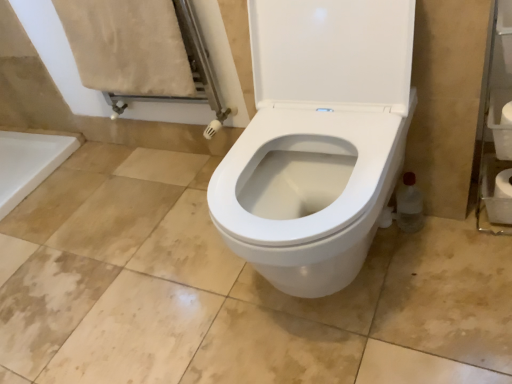
What do you see at coordinates (502, 130) in the screenshot?
I see `white matte toilet paper at right, acting as the 2th toilet paper starting from the back` at bounding box center [502, 130].

This screenshot has height=384, width=512. Identify the location of white matte toilet paper at right, acting as the second toilet paper starting from the bottom. (502, 130).

What is the approximate height of white matte toilet paper at right, which is the 1th toilet paper in back-to-front order?

5.09 inches.

This screenshot has width=512, height=384. I want to click on white matte toilet paper at right, the 2th toilet paper positioned from the top, so [498, 196].

What do you see at coordinates (498, 196) in the screenshot? This screenshot has width=512, height=384. I see `white matte toilet paper at right, which is the 1th toilet paper in back-to-front order` at bounding box center [498, 196].

Identify the location of white matte toilet paper at right, the first toilet paper when ordered from front to back. The height and width of the screenshot is (384, 512). (502, 130).

Between white matte toilet paper at right, which ranks as the 2th toilet paper in front-to-back order, and white matte toilet paper at right, acting as the 2th toilet paper starting from the back, which one appears on the right side from the viewer's perspective?

Positioned to the right is white matte toilet paper at right, which ranks as the 2th toilet paper in front-to-back order.

Who is more distant, white matte toilet paper at right, which is the 1th toilet paper in back-to-front order, or white matte toilet paper at right, acting as the second toilet paper starting from the bottom?

white matte toilet paper at right, which is the 1th toilet paper in back-to-front order, is further from the camera.

Considering the points (510, 219) and (507, 128), which point is in front, point (510, 219) or point (507, 128)?

The point (507, 128) is more forward.

From the image's perspective, which is below, white matte toilet paper at right, the 2th toilet paper positioned from the top, or white matte toilet paper at right, the 1th toilet paper in the top-to-bottom sequence?

white matte toilet paper at right, the 2th toilet paper positioned from the top.

From a real-world perspective, is white matte toilet paper at right, which ranks as the 2th toilet paper in front-to-back order, physically located above or below white matte toilet paper at right, acting as the second toilet paper starting from the bottom?

Clearly, from a real-world perspective, white matte toilet paper at right, which ranks as the 2th toilet paper in front-to-back order, is below white matte toilet paper at right, acting as the second toilet paper starting from the bottom.

Can you confirm if white matte toilet paper at right, which ranks as the first toilet paper in bottom-to-top order, is wider than white matte toilet paper at right, the first toilet paper when ordered from front to back?

Correct, the width of white matte toilet paper at right, which ranks as the first toilet paper in bottom-to-top order, exceeds that of white matte toilet paper at right, the first toilet paper when ordered from front to back.

Is white matte toilet paper at right, the 2th toilet paper positioned from the top, taller or shorter than white matte toilet paper at right, the first toilet paper when ordered from front to back?

Considering their sizes, white matte toilet paper at right, the 2th toilet paper positioned from the top, has more height than white matte toilet paper at right, the first toilet paper when ordered from front to back.

Can you confirm if white matte toilet paper at right, which is the 1th toilet paper in back-to-front order, is smaller than white matte toilet paper at right, acting as the 2th toilet paper starting from the back?

No, white matte toilet paper at right, which is the 1th toilet paper in back-to-front order, is not smaller than white matte toilet paper at right, acting as the 2th toilet paper starting from the back.

Choose the correct answer: Is white matte toilet paper at right, the 2th toilet paper positioned from the top, inside white matte toilet paper at right, the first toilet paper when ordered from front to back, or outside it?

white matte toilet paper at right, the 2th toilet paper positioned from the top, is located beyond the bounds of white matte toilet paper at right, the first toilet paper when ordered from front to back.

Would you say white matte toilet paper at right, which is the 1th toilet paper in back-to-front order, is a long distance from white matte toilet paper at right, the 1th toilet paper in the top-to-bottom sequence?

white matte toilet paper at right, which is the 1th toilet paper in back-to-front order, is near white matte toilet paper at right, the 1th toilet paper in the top-to-bottom sequence, not far away.

Does white matte toilet paper at right, the 2th toilet paper positioned from the top, turn towards white matte toilet paper at right, acting as the second toilet paper starting from the bottom?

No, white matte toilet paper at right, the 2th toilet paper positioned from the top, is not aimed at white matte toilet paper at right, acting as the second toilet paper starting from the bottom.

Identify the location of toilet paper located above the white matte toilet paper at right, the 2th toilet paper positioned from the top (from a real-world perspective). (502, 130).

Can you confirm if white matte toilet paper at right, the first toilet paper when ordered from front to back, is positioned to the right of white matte toilet paper at right, the 2th toilet paper positioned from the top?

No, white matte toilet paper at right, the first toilet paper when ordered from front to back, is not to the right of white matte toilet paper at right, the 2th toilet paper positioned from the top.

Is white matte toilet paper at right, acting as the second toilet paper starting from the bottom, positioned in front of white matte toilet paper at right, the 2th toilet paper positioned from the top?

Yes, white matte toilet paper at right, acting as the second toilet paper starting from the bottom, is closer to the viewer.

Considering the positions of point (505, 113) and point (490, 200), is point (505, 113) closer or farther from the camera than point (490, 200)?

Clearly, point (505, 113) is closer to the camera than point (490, 200).

From the image's perspective, is white matte toilet paper at right, acting as the second toilet paper starting from the bottom, positioned above or below white matte toilet paper at right, which ranks as the first toilet paper in bottom-to-top order?

Clearly, from the image's perspective, white matte toilet paper at right, acting as the second toilet paper starting from the bottom, is above white matte toilet paper at right, which ranks as the first toilet paper in bottom-to-top order.

From a real-world perspective, relative to white matte toilet paper at right, which is the 1th toilet paper in back-to-front order, is white matte toilet paper at right, the 1th toilet paper in the top-to-bottom sequence, vertically above or below?

Answer: In terms of real-world spatial position, white matte toilet paper at right, the 1th toilet paper in the top-to-bottom sequence, is above white matte toilet paper at right, which is the 1th toilet paper in back-to-front order.

Can you confirm if white matte toilet paper at right, the first toilet paper when ordered from front to back, is wider than white matte toilet paper at right, which ranks as the 2th toilet paper in front-to-back order?

No, white matte toilet paper at right, the first toilet paper when ordered from front to back, is not wider than white matte toilet paper at right, which ranks as the 2th toilet paper in front-to-back order.

Looking at this image, who is taller, white matte toilet paper at right, acting as the second toilet paper starting from the bottom, or white matte toilet paper at right, which is the 1th toilet paper in back-to-front order?

white matte toilet paper at right, which is the 1th toilet paper in back-to-front order.

Does white matte toilet paper at right, acting as the 2th toilet paper starting from the back, have a smaller size compared to white matte toilet paper at right, which ranks as the first toilet paper in bottom-to-top order?

Indeed, white matte toilet paper at right, acting as the 2th toilet paper starting from the back, has a smaller size compared to white matte toilet paper at right, which ranks as the first toilet paper in bottom-to-top order.

Can we say white matte toilet paper at right, acting as the second toilet paper starting from the bottom, lies outside white matte toilet paper at right, the 2th toilet paper positioned from the top?

white matte toilet paper at right, acting as the second toilet paper starting from the bottom, is positioned outside white matte toilet paper at right, the 2th toilet paper positioned from the top.

Is white matte toilet paper at right, the 1th toilet paper in the top-to-bottom sequence, not close to white matte toilet paper at right, which is the 1th toilet paper in back-to-front order?

No, there isn't a large distance between white matte toilet paper at right, the 1th toilet paper in the top-to-bottom sequence, and white matte toilet paper at right, which is the 1th toilet paper in back-to-front order.

Could you tell me if white matte toilet paper at right, the 1th toilet paper in the top-to-bottom sequence, is facing white matte toilet paper at right, which ranks as the first toilet paper in bottom-to-top order?

No, white matte toilet paper at right, the 1th toilet paper in the top-to-bottom sequence, is not oriented towards white matte toilet paper at right, which ranks as the first toilet paper in bottom-to-top order.

What's the angular difference between white matte toilet paper at right, the 1th toilet paper in the top-to-bottom sequence, and white matte toilet paper at right, the 2th toilet paper positioned from the top,'s facing directions?

0.00289 degrees.

Consider the image. How far apart are white matte toilet paper at right, the 1th toilet paper in the top-to-bottom sequence, and white matte toilet paper at right, which is the 1th toilet paper in back-to-front order?

The distance of white matte toilet paper at right, the 1th toilet paper in the top-to-bottom sequence, from white matte toilet paper at right, which is the 1th toilet paper in back-to-front order, is 5.39 inches.

Locate an element on the screen. This screenshot has height=384, width=512. toilet paper in front of the white matte toilet paper at right, which is the 1th toilet paper in back-to-front order is located at coordinates (502, 130).

Identify the location of toilet paper lying on the right of white matte toilet paper at right, acting as the 2th toilet paper starting from the back. (498, 196).

Where is `toilet paper that is on the left side of white matte toilet paper at right, which ranks as the 2th toilet paper in front-to-back order`? The height and width of the screenshot is (384, 512). toilet paper that is on the left side of white matte toilet paper at right, which ranks as the 2th toilet paper in front-to-back order is located at coordinates (502, 130).